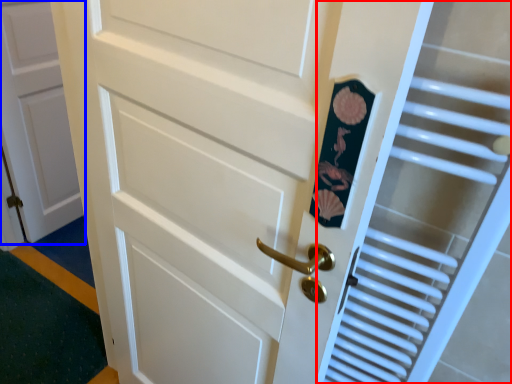
Question: Among these objects, which one is farthest to the camera, elevator (highlighted by a red box) or door (highlighted by a blue box)?

Choices:
 (A) elevator
 (B) door

Answer: (B)